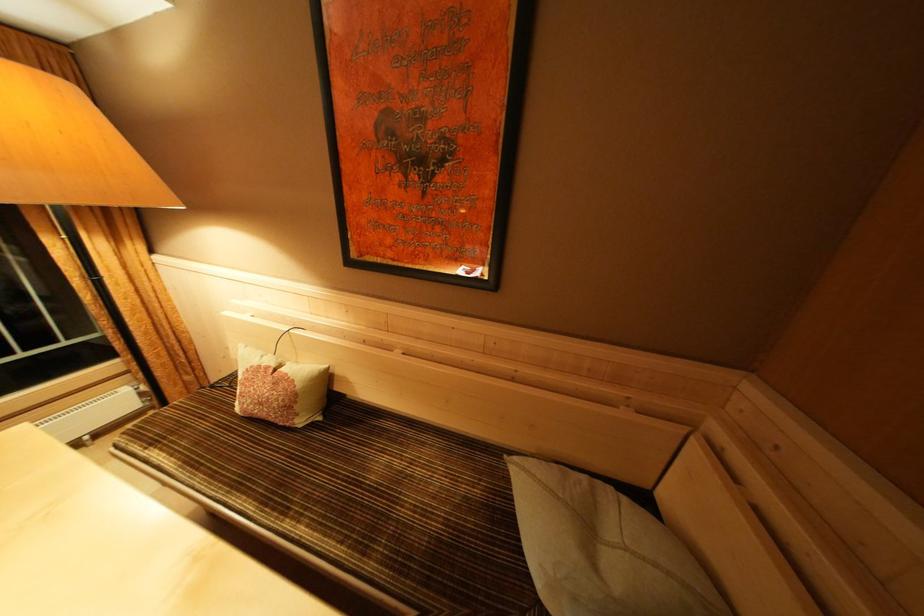
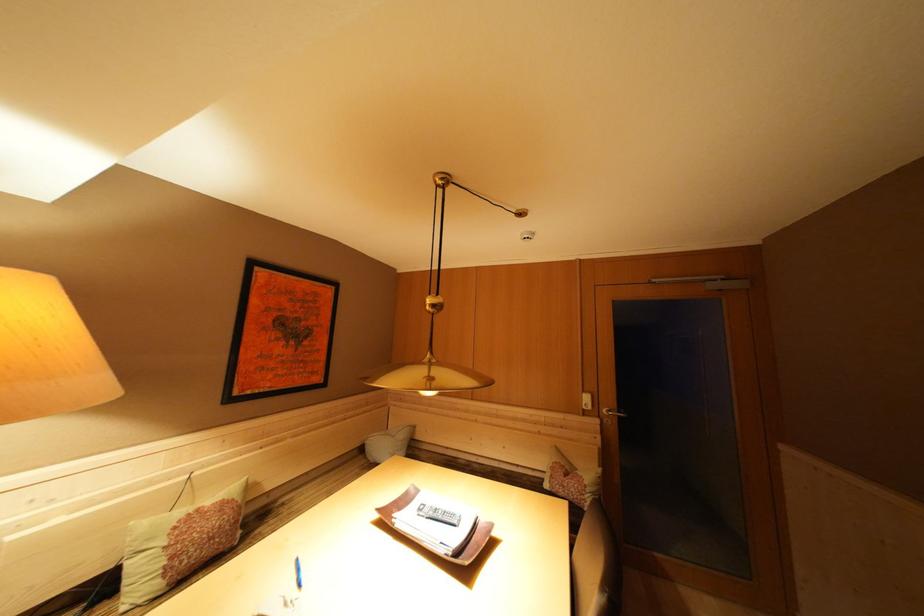
Where in the second image is the point corresponding to pixel 274 373 from the first image?

(204, 515)